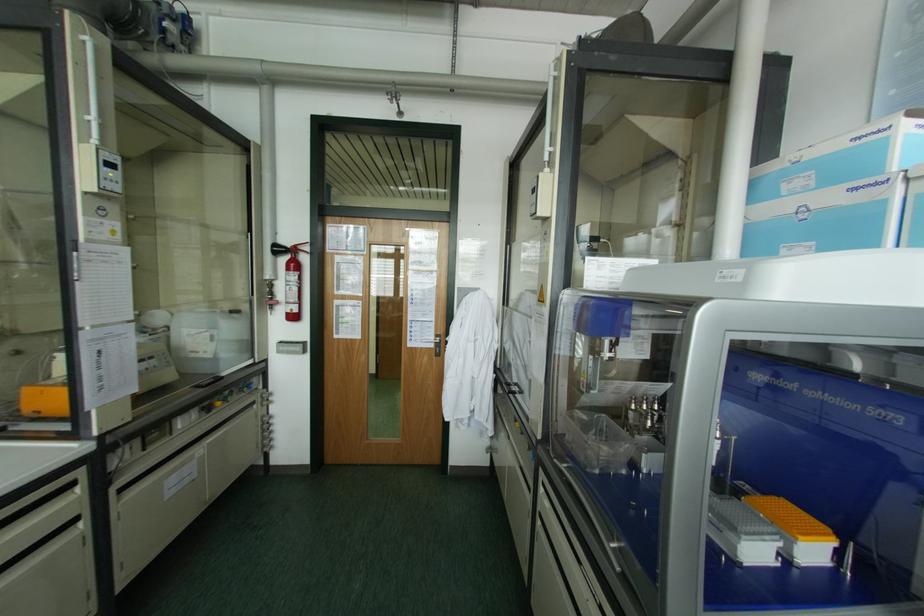
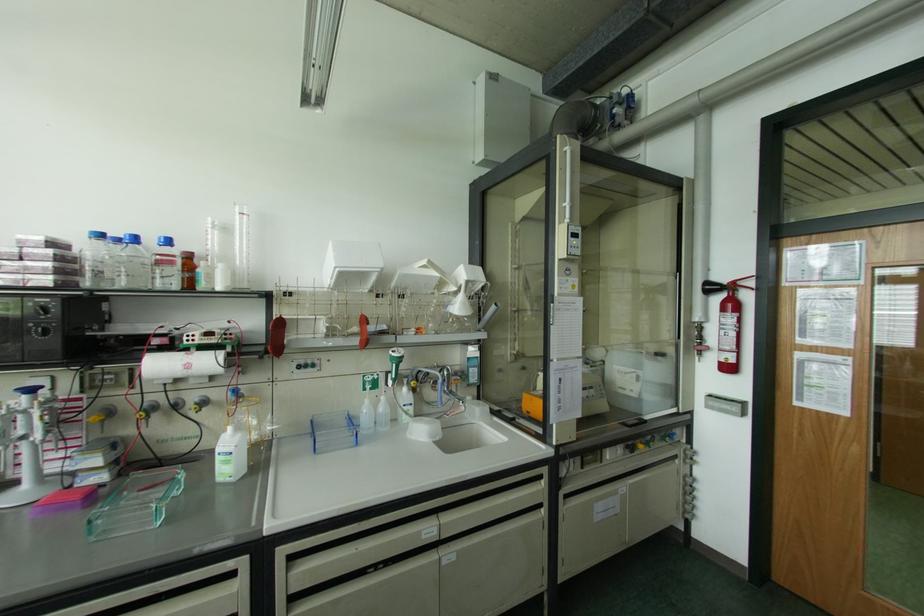
Find the pixel in the second image that matches the point at 274,245 in the first image.

(707, 283)